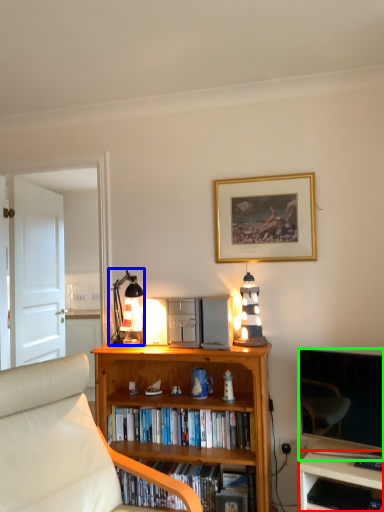
Question: Considering the real-world distances, which object is farthest from desk (highlighted by a red box)? table lamp (highlighted by a blue box) or television (highlighted by a green box)?

Choices:
 (A) table lamp
 (B) television

Answer: (A)